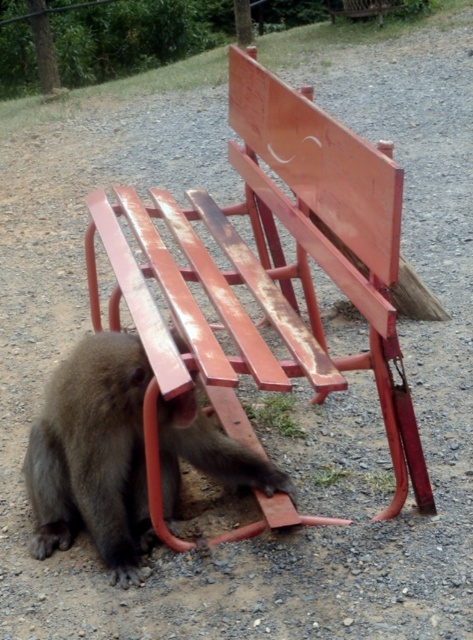
You are standing in a park and see both the rusty wood bench at lower left and the fuzzy brown monkey at lower left. Which object is positioned more to the right from your viewpoint?

The rusty wood bench at lower left is positioned to the right of the fuzzy brown monkey at lower left, so the bench is more to the right.

You are standing in a park and see the rusty wood bench at lower left and the fuzzy brown monkey at lower left. Which object is closer to you?

The rusty wood bench at lower left is closer to you because it is in front of the fuzzy brown monkey at lower left.

You are standing at the point with coordinates (268, 272). Looking around, you see a rusty wood bench at lower left. What is located at your current position?

At point (268, 272) lies rusty wood bench at lower left.